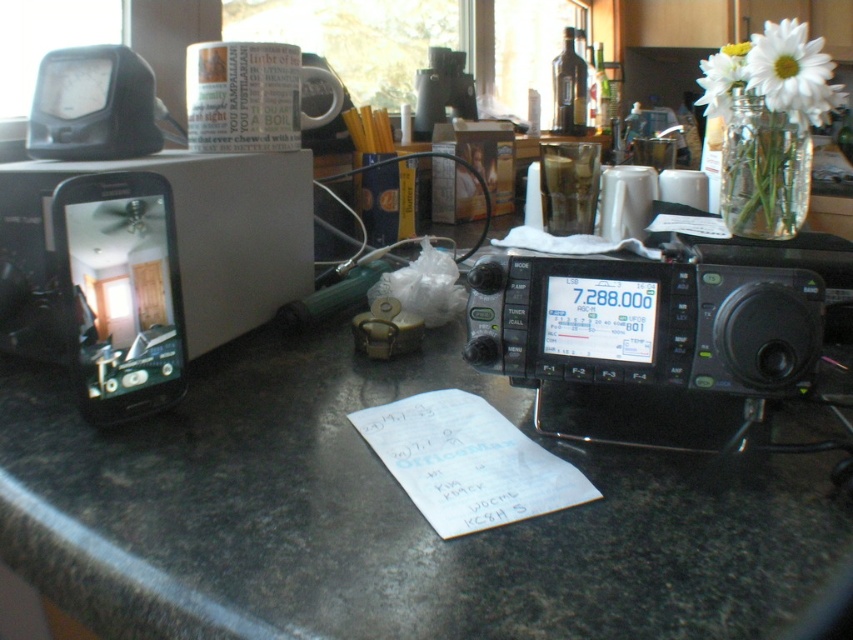
The width and height of the screenshot is (853, 640). I want to click on black granite countertop at center, so click(381, 516).

Does point (807, 472) come behind point (776, 29)?

No, it is in front of (776, 29).

You are a GUI agent. You are given a task and a screenshot of the screen. Output one action in this format:
    pyautogui.click(x=<x>, y=<y>)
    Task: Click on the black granite countertop at center
    The height and width of the screenshot is (640, 853).
    Given the screenshot: What is the action you would take?
    pyautogui.click(x=381, y=516)

Who is more forward, (293, 502) or (722, 58)?

Point (293, 502) is in front.

Does point (582, 452) come farther from viewer compared to point (741, 52)?

No, (582, 452) is in front of (741, 52).

Is point (293, 376) in front of point (722, 93)?

That is True.

This screenshot has width=853, height=640. What are the coordinates of `black granite countertop at center` in the screenshot? It's located at click(381, 516).

Who is taller, black plastic radio at center or black plastic smartphone at left?

Standing taller between the two is black plastic smartphone at left.

Can you confirm if black plastic radio at center is smaller than black plastic smartphone at left?

No.

I want to click on black plastic radio at center, so click(x=648, y=340).